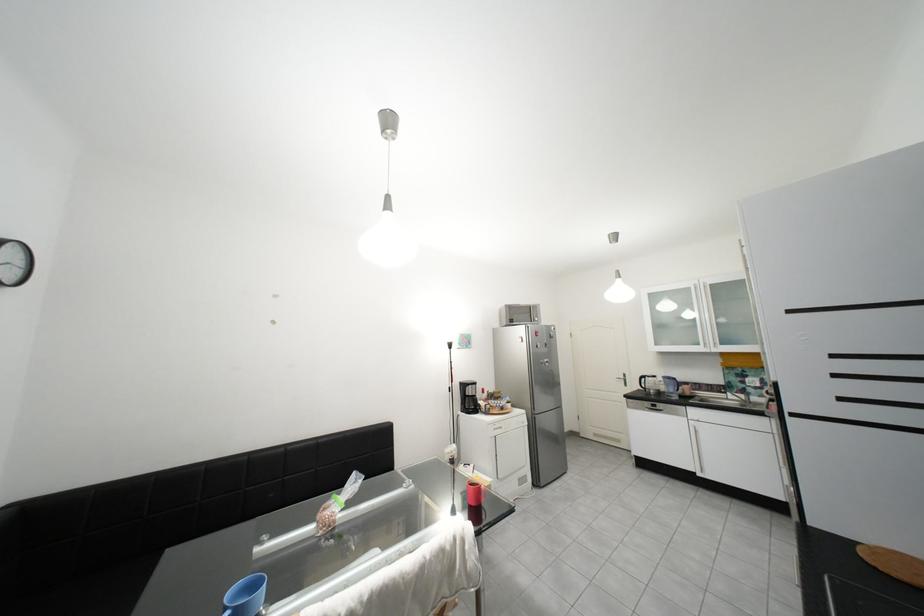
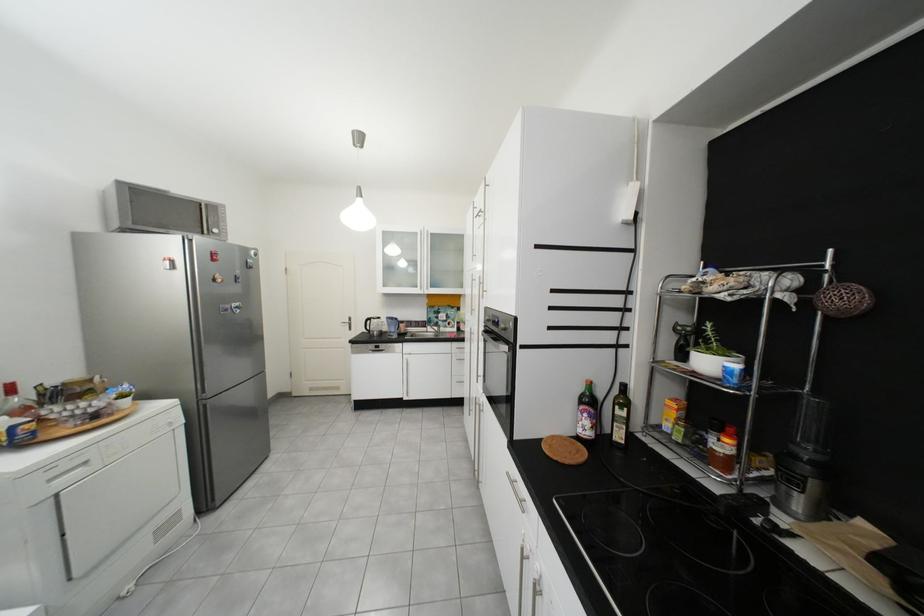
Find the pixel in the second image that matches (x=716, y=389) in the first image.

(426, 325)